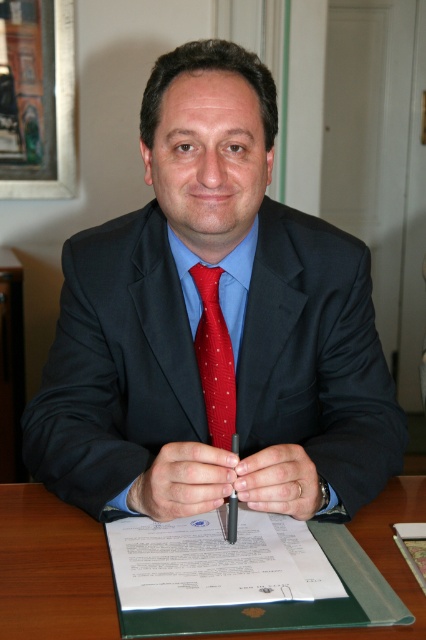
Question: Does matte black suit at center appear on the right side of red dotted fabric tie at center?

Choices:
 (A) no
 (B) yes

Answer: (B)

Question: Can you confirm if matte black suit at center is positioned above red dotted fabric tie at center?

Choices:
 (A) no
 (B) yes

Answer: (B)

Question: Which point appears closest to the camera in this image?

Choices:
 (A) (57, 582)
 (B) (264, 592)
 (C) (218, 435)

Answer: (B)

Question: Which object appears closest to the camera in this image?

Choices:
 (A) matte black suit at center
 (B) metallic red pen at center

Answer: (A)

Question: Can you confirm if red dotted fabric tie at center is positioned above metallic red pen at center?

Choices:
 (A) yes
 (B) no

Answer: (A)

Question: Which object is positioned closest to the metallic red pen at center?

Choices:
 (A) matte black suit at center
 (B) red dotted fabric tie at center
 (C) green leather folder at center
 (D) white paper at center

Answer: (D)